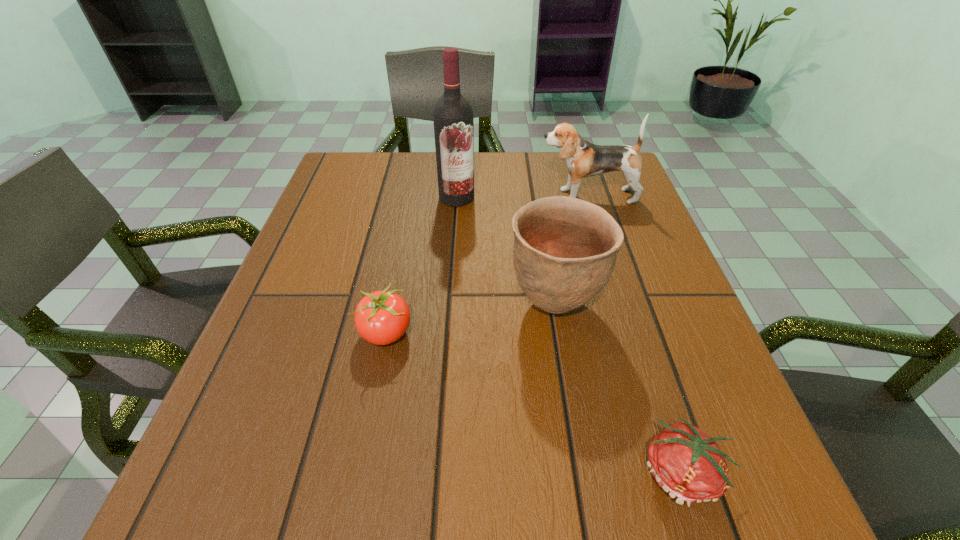
The image size is (960, 540). I want to click on free spot that satisfies the following two spatial constraints: 1. on the label of the pottery; 2. on the left side of the tallest object, so click(449, 303).

The image size is (960, 540). Find the location of `blank space that satisfies the following two spatial constraints: 1. at the face of the puppy; 2. on the back side of the nearest object`. blank space that satisfies the following two spatial constraints: 1. at the face of the puppy; 2. on the back side of the nearest object is located at coordinates (673, 474).

In order to click on vacant area in the image that satisfies the following two spatial constraints: 1. on the front side of the pottery; 2. on the left side of the right tomato in this screenshot , I will do `click(582, 474)`.

The height and width of the screenshot is (540, 960). Find the location of `vacant area in the image that satisfies the following two spatial constraints: 1. at the face of the right tomato; 2. on the right side of the puppy`. vacant area in the image that satisfies the following two spatial constraints: 1. at the face of the right tomato; 2. on the right side of the puppy is located at coordinates (673, 474).

Identify the location of free space that satisfies the following two spatial constraints: 1. at the face of the puppy; 2. on the label of the fourth object from right to left. The image size is (960, 540). (588, 197).